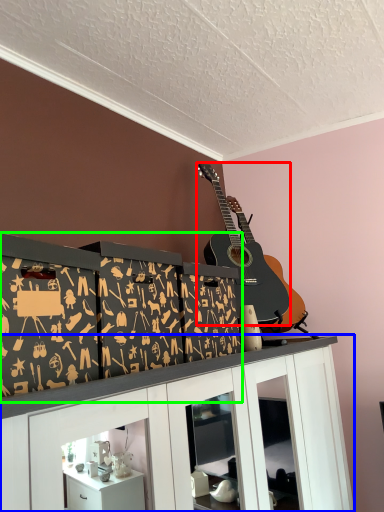
Question: Considering the real-world distances, which object is farthest from guitar (highlighted by a red box)? cabinetry (highlighted by a blue box) or shelf (highlighted by a green box)?

Choices:
 (A) cabinetry
 (B) shelf

Answer: (A)